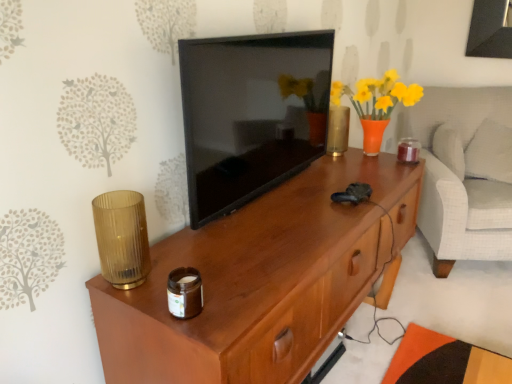
Question: Can you confirm if black glossy tv at center is positioned to the right of white soft pillow at right?

Choices:
 (A) no
 (B) yes

Answer: (A)

Question: Is black glossy tv at center further to the viewer compared to white soft pillow at right?

Choices:
 (A) yes
 (B) no

Answer: (B)

Question: Can you confirm if black glossy tv at center is thinner than white soft pillow at right?

Choices:
 (A) yes
 (B) no

Answer: (A)

Question: Considering the relative sizes of black glossy tv at center and white soft pillow at right in the image provided, is black glossy tv at center smaller than white soft pillow at right?

Choices:
 (A) no
 (B) yes

Answer: (A)

Question: Is white soft pillow at right surrounded by black glossy tv at center?

Choices:
 (A) no
 (B) yes

Answer: (A)

Question: From their relative heights in the image, would you say white soft pillow at right is taller or shorter than brown glass jar at lower center, the 2th candle holder when ordered from right to left?

Choices:
 (A) tall
 (B) short

Answer: (A)

Question: Is white soft pillow at right to the left or to the right of brown glass jar at lower center, the 3th candle holder positioned from the back, in the image?

Choices:
 (A) left
 (B) right

Answer: (B)

Question: From the image's perspective, is white soft pillow at right above or below brown glass jar at lower center, the second candle holder when ordered from left to right?

Choices:
 (A) below
 (B) above

Answer: (B)

Question: Looking at their shapes, would you say white soft pillow at right is wider or thinner than brown glass jar at lower center, the third candle holder from the top?

Choices:
 (A) wide
 (B) thin

Answer: (A)

Question: Is white soft pillow at right situated inside wooden desk at center or outside?

Choices:
 (A) inside
 (B) outside

Answer: (B)

Question: From a real-world perspective, is white soft pillow at right physically located above or below wooden desk at center?

Choices:
 (A) above
 (B) below

Answer: (A)

Question: Is white soft pillow at right to the left or to the right of wooden desk at center in the image?

Choices:
 (A) right
 (B) left

Answer: (A)

Question: Considering the positions of white soft pillow at right and wooden desk at center in the image, is white soft pillow at right bigger or smaller than wooden desk at center?

Choices:
 (A) small
 (B) big

Answer: (A)

Question: Relative to translucent amber glass candle at right, the 1th candle holder viewed from the back, is amber ribbed glass at left, which ranks as the 2th candle holder in back-to-front order, in front or behind?

Choices:
 (A) behind
 (B) front

Answer: (B)

Question: Would you say amber ribbed glass at left, which ranks as the first candle holder in left-to-right order, is to the left or to the right of translucent amber glass candle at right, which appears as the 1th candle holder when viewed from the top, in the picture?

Choices:
 (A) left
 (B) right

Answer: (A)